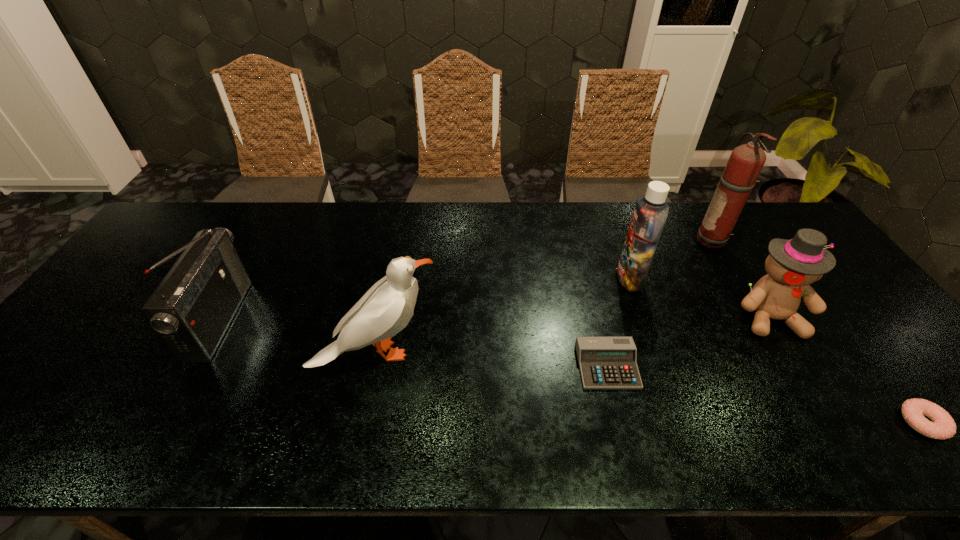
Where is `the farthest object`? the farthest object is located at coordinates (745, 163).

Find the location of `the tallest object`. the tallest object is located at coordinates (745, 163).

Image resolution: width=960 pixels, height=540 pixels. I want to click on shampoo, so click(x=650, y=213).

You are a GUI agent. You are given a task and a screenshot of the screen. Output one action in this format:
    pyautogui.click(x=<x>, y=<y>)
    Task: Click on the radio receiver
    The image size is (960, 540).
    Given the screenshot: What is the action you would take?
    pyautogui.click(x=192, y=308)

Identify the location of the second object from left to right. The width and height of the screenshot is (960, 540). (386, 308).

Where is `rag_doll`? rag_doll is located at coordinates pos(792,265).

Locate an element on the screen. The image size is (960, 540). the fifth object from right to left is located at coordinates (605, 362).

Where is `vacant space situated 0.330m on the side of the fire extinguisher with the label and nozzle`? This screenshot has height=540, width=960. vacant space situated 0.330m on the side of the fire extinguisher with the label and nozzle is located at coordinates (592, 242).

This screenshot has width=960, height=540. In order to click on free spot located on the side of the fire extinguisher with the label and nozzle in this screenshot , I will do `click(634, 242)`.

Where is `free location located 0.170m on the side of the fire extinguisher with the label and nozzle`? free location located 0.170m on the side of the fire extinguisher with the label and nozzle is located at coordinates (643, 242).